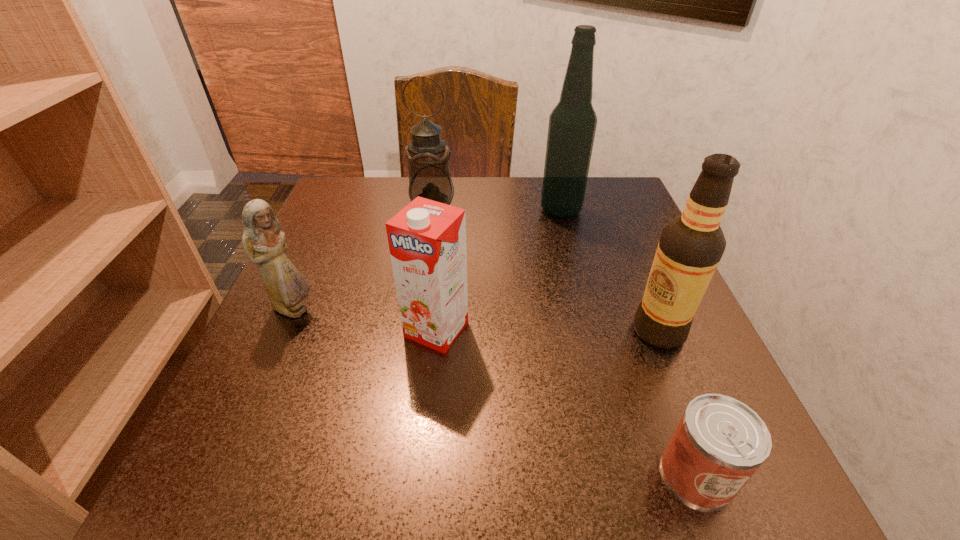
You are a GUI agent. You are given a task and a screenshot of the screen. Output one action in this format:
    pyautogui.click(x=<x>, y=<y>)
    Task: Click on the vacant space at the near right corner of the desktop
    
    Given the screenshot: What is the action you would take?
    pyautogui.click(x=756, y=503)

Locate an element on the screen. The image size is (960, 540). free area in between the figurine and the oil lamp is located at coordinates (363, 260).

In order to click on vacant region between the shorter alcohol and the taller alcohol in this screenshot , I will do `click(610, 271)`.

The width and height of the screenshot is (960, 540). In order to click on free space between the shorter alcohol and the oil lamp in this screenshot , I will do `click(545, 270)`.

Locate an element on the screen. The width and height of the screenshot is (960, 540). empty space between the right alcohol and the shortest object is located at coordinates (678, 402).

Where is `empty space between the can and the left alcohol`? empty space between the can and the left alcohol is located at coordinates (629, 342).

Where is `free spot between the nearer alcohol and the figurine`? This screenshot has width=960, height=540. free spot between the nearer alcohol and the figurine is located at coordinates (476, 320).

Find the location of a particular element. object that stands as the fifth closest to the leftmost object is located at coordinates (719, 443).

This screenshot has width=960, height=540. What are the coordinates of `object that is the closest to the figurine` in the screenshot? It's located at (427, 239).

The image size is (960, 540). I want to click on vacant space that satisfies the following two spatial constraints: 1. on the front-facing side of the carton; 2. on the right side of the leftmost object, so click(x=285, y=329).